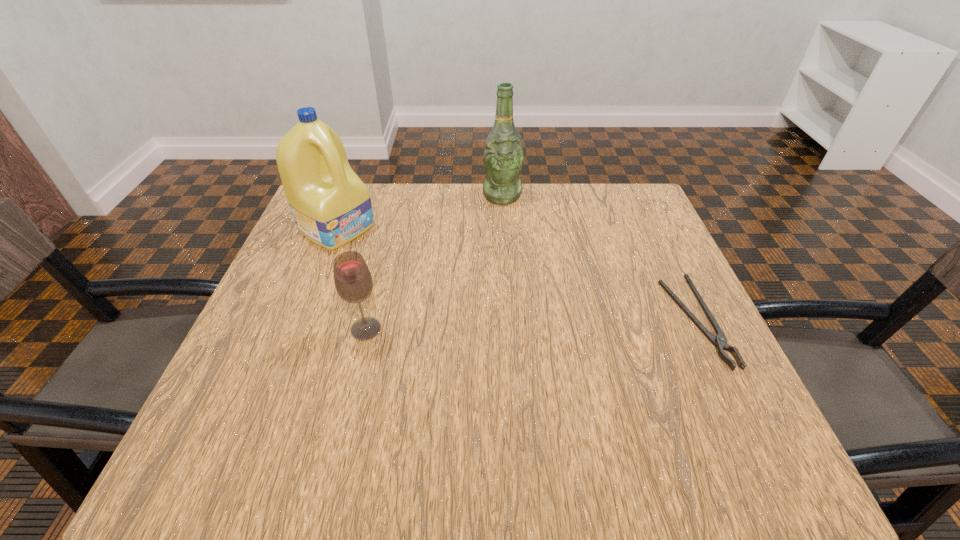
Image resolution: width=960 pixels, height=540 pixels. I want to click on vacant point located between the second object from left to right and the rightmost object, so click(x=531, y=326).

Identify the location of object that is the second nearest to the third tallest object. This screenshot has width=960, height=540. (503, 157).

Select which object is the third closest to the second object from left to right. Please provide its 2D coordinates. Your answer should be formatted as a tuple, i.e. [(x, y)], where the tuple contains the x and y coordinates of a point satisfying the conditions above.

[(720, 341)]

Locate an element on the screen. vacant area that satisfies the following two spatial constraints: 1. on the front side of the third object from left to right; 2. on the right side of the rightmost object is located at coordinates (511, 322).

Find the location of a particular element. blank area in the image that satisfies the following two spatial constraints: 1. on the back side of the glass drink container; 2. on the left side of the beer bottle is located at coordinates (399, 195).